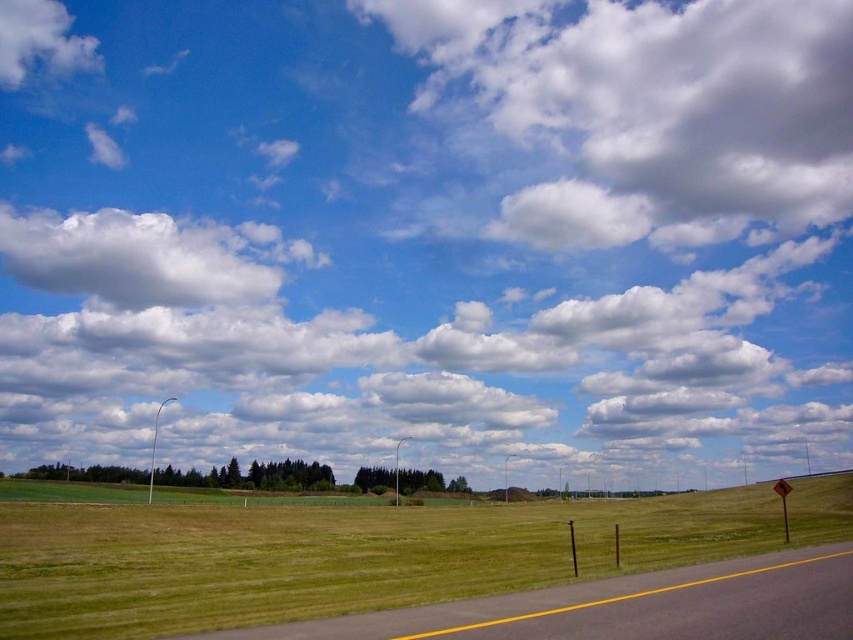
Question: Considering the real-world distances, which object is closest to the gray asphalt highway at lower center?

Choices:
 (A) green grass at lower center
 (B) white fluffy cloud at upper center

Answer: (A)

Question: Does white fluffy cloud at upper center have a smaller size compared to green grass at lower center?

Choices:
 (A) no
 (B) yes

Answer: (A)

Question: Among these points, which one is nearest to the camera?

Choices:
 (A) (585, 108)
 (B) (230, 582)
 (C) (466, 621)

Answer: (C)

Question: Can you confirm if white fluffy cloud at upper center is positioned above green grass at lower center?

Choices:
 (A) yes
 (B) no

Answer: (A)

Question: Which object is closer to the camera taking this photo?

Choices:
 (A) gray asphalt highway at lower center
 (B) green grass at lower center
 (C) white fluffy cloud at upper center

Answer: (A)

Question: Is green grass at lower center smaller than gray asphalt highway at lower center?

Choices:
 (A) yes
 (B) no

Answer: (B)